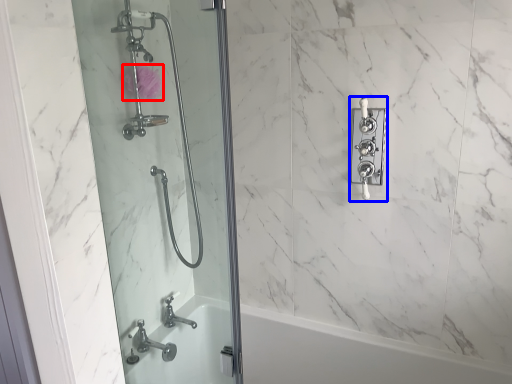
Question: Which object is further to the camera taking this photo, flower (highlighted by a red box) or lock (highlighted by a blue box)?

Choices:
 (A) flower
 (B) lock

Answer: (A)